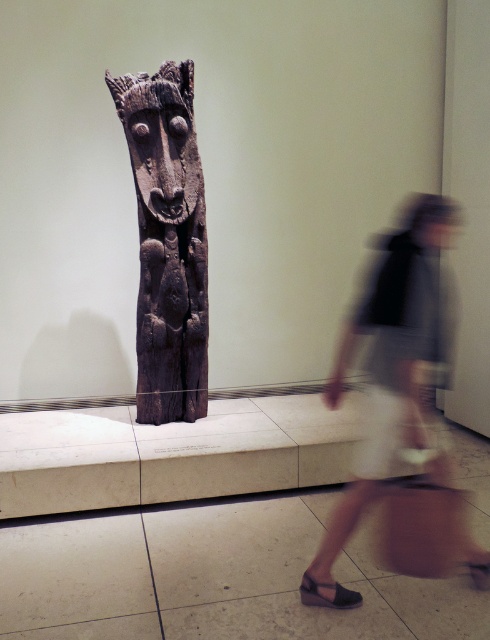
Does dark wood carving at center have a smaller size compared to black leather sandal at lower center?

Incorrect, dark wood carving at center is not smaller in size than black leather sandal at lower center.

Is point (163, 173) farther from viewer compared to point (343, 604)?

Yes, point (163, 173) is farther from viewer.

Find the location of a particular element. dark wood carving at center is located at coordinates 168,241.

Can you confirm if light beige skirt at lower right is positioned to the right of black leather sandal at lower center?

Yes, light beige skirt at lower right is to the right of black leather sandal at lower center.

Can you confirm if light beige skirt at lower right is positioned above black leather sandal at lower center?

Indeed, light beige skirt at lower right is positioned over black leather sandal at lower center.

Identify the location of light beige skirt at lower right. (405, 406).

Locate an element on the screen. This screenshot has width=490, height=640. light beige skirt at lower right is located at coordinates (405, 406).

Can you confirm if light beige skirt at lower right is positioned to the left of dark wood carving at center?

No, light beige skirt at lower right is not to the left of dark wood carving at center.

Can you confirm if light beige skirt at lower right is shorter than dark wood carving at center?

Yes, light beige skirt at lower right is shorter than dark wood carving at center.

Where is `light beige skirt at lower right`? The image size is (490, 640). light beige skirt at lower right is located at coordinates (405, 406).